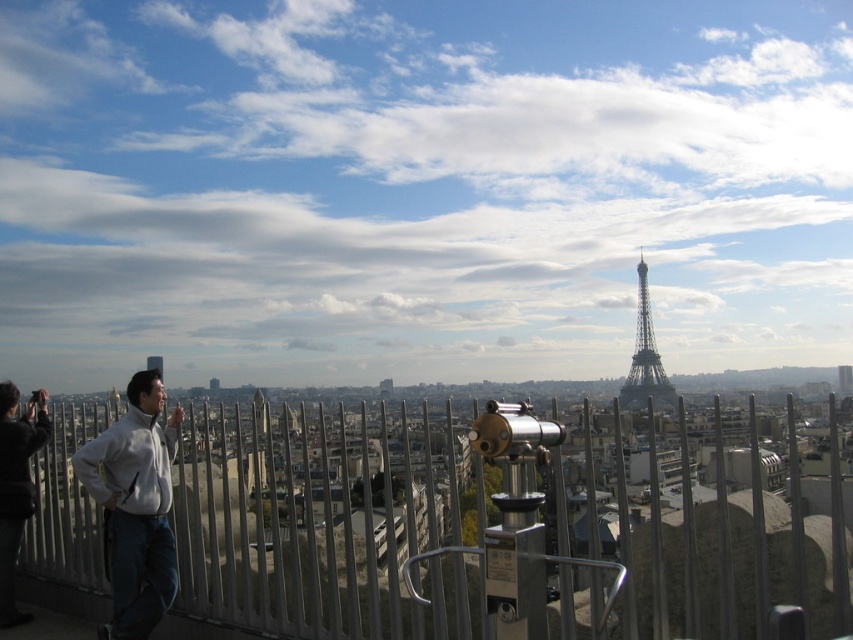
Question: Is metallic silver fence at center further to camera compared to shiny metallic eiffel tower at center?

Choices:
 (A) no
 (B) yes

Answer: (A)

Question: Which object appears closest to the camera in this image?

Choices:
 (A) shiny metallic eiffel tower at center
 (B) metallic silver fence at center
 (C) white fleece jacket at lower left

Answer: (B)

Question: Which object appears farthest from the camera in this image?

Choices:
 (A) metallic silver fence at center
 (B) white fleece jacket at lower left
 (C) shiny metallic eiffel tower at center

Answer: (C)

Question: Which point appears farthest from the camera in this image?

Choices:
 (A) (218, 616)
 (B) (113, 538)

Answer: (A)

Question: Does metallic silver fence at center appear on the left side of white fleece jacket at lower left?

Choices:
 (A) no
 (B) yes

Answer: (A)

Question: Is metallic silver fence at center behind white fleece jacket at lower left?

Choices:
 (A) no
 (B) yes

Answer: (A)